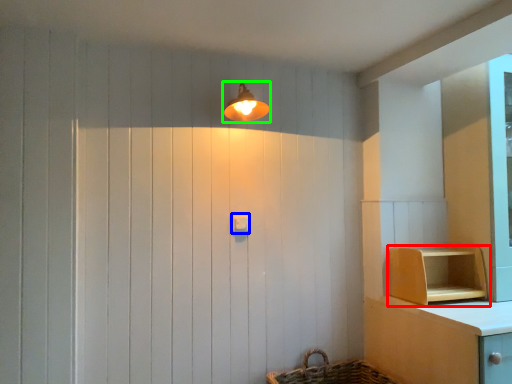
Question: Which object is the closest to the shelf (highlighted by a red box)? Choose among these: light switch (highlighted by a blue box) or light fixture (highlighted by a green box).

Choices:
 (A) light switch
 (B) light fixture

Answer: (A)